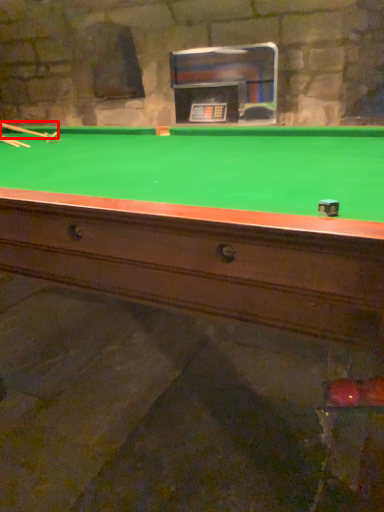
Question: From the image, what is the correct spatial relationship of cue (annotated by the red box) in relation to cue?

Choices:
 (A) left
 (B) right

Answer: (A)